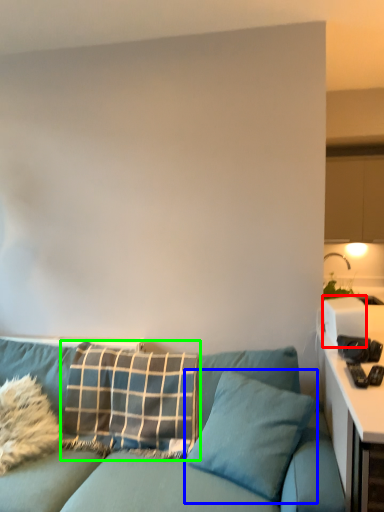
Question: Which object is positioned farthest from appliance (highlighted by a red box)? Select from pillow (highlighted by a blue box) and pillow (highlighted by a green box).

Choices:
 (A) pillow
 (B) pillow

Answer: (B)